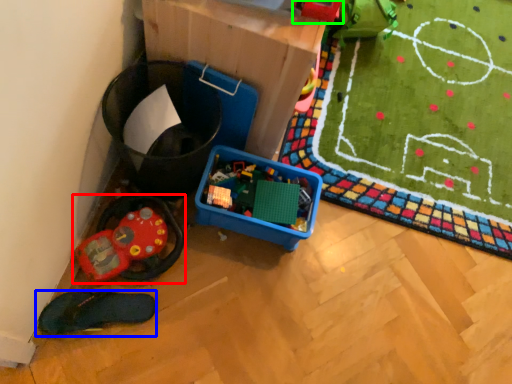
Question: Which object is positioned farthest from toy (highlighted by a red box)? Select from footwear (highlighted by a blue box) and toy (highlighted by a green box).

Choices:
 (A) footwear
 (B) toy

Answer: (B)